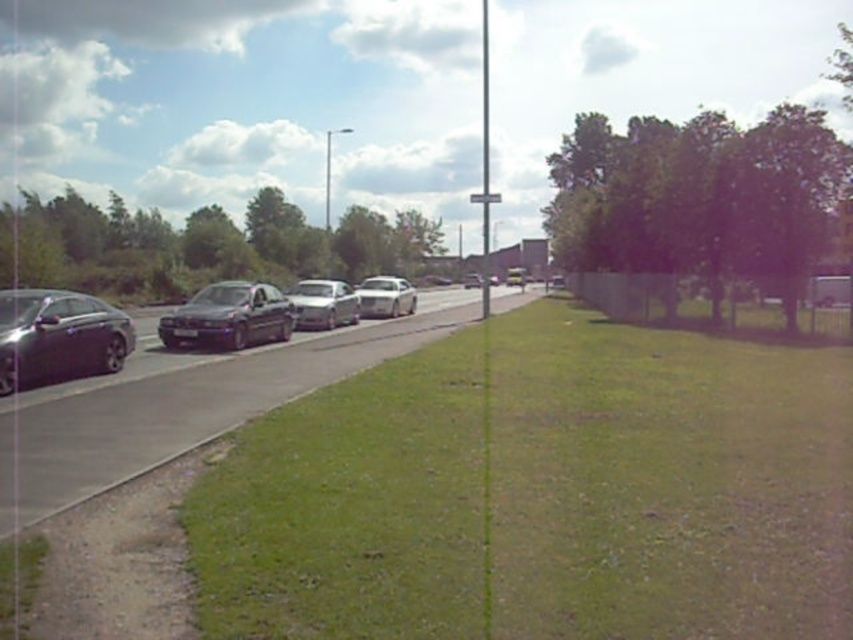
You are a driver planning to park your car in the parking spot between the satin silver sedan at center and the white glossy car at center. Which car should you move around to access the parking spot?

The satin silver sedan at center is shorter than the white glossy car at center, so you should move around the satin silver sedan at center to access the parking spot since it is lower and less obstructive.

You are a pedestrian standing at the point marked by the coordinates point [229,316]. You want to cross the road to reach the grassy area on the left side. Is the road clear of vehicles in front of you at this point?

The point marked by point [229,316] is the location of the satin black sedan at center. Since you are standing at the location of the satin black sedan at center, you cannot cross the road from there as you are already at that point.

You are a pedestrian standing at the crosswalk near the green grass at center and the shiny black sedan at left. Which object is closer to you?

The green grass at center is closer to you because it is positioned in front of the shiny black sedan at left, indicating it is nearer in the scene.